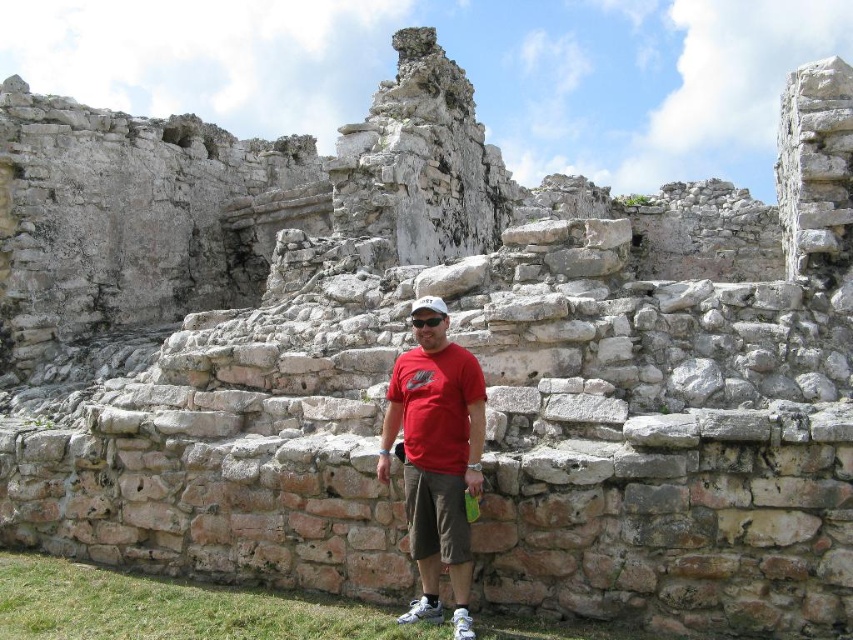
Question: Does matte red t-shirt at center lie behind white matte baseball cap at center?

Choices:
 (A) yes
 (B) no

Answer: (B)

Question: Is matte red t-shirt at center further to the viewer compared to white matte baseball cap at center?

Choices:
 (A) no
 (B) yes

Answer: (A)

Question: Observing the image, what is the correct spatial positioning of matte red t-shirt at center in reference to white matte baseball cap at center?

Choices:
 (A) below
 (B) above

Answer: (A)